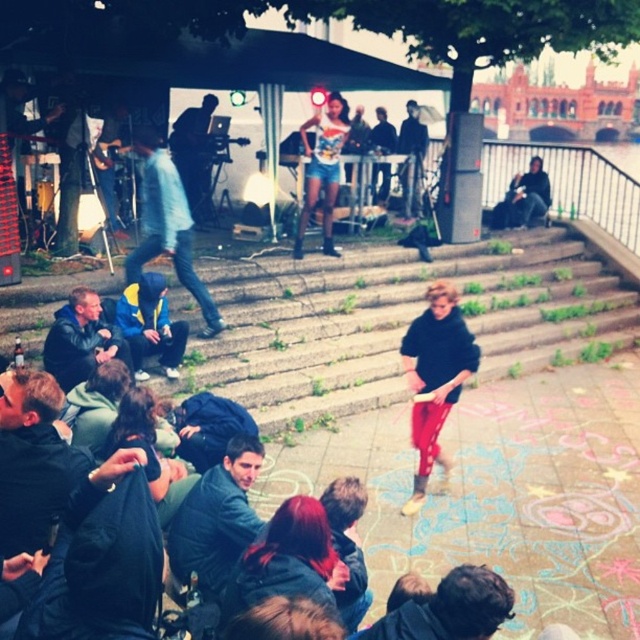
Which is behind, point (241, 460) or point (186, 208)?

Point (186, 208)

You are a GUI agent. You are given a task and a screenshot of the screen. Output one action in this format:
    pyautogui.click(x=<x>, y=<y>)
    Task: Click on the dark blue jacket at lower left
    
    Given the screenshot: What is the action you would take?
    pyautogui.click(x=216, y=518)

Can you confirm if dark blue jacket at lower left is thinner than leather jacket at lower left?

Yes, dark blue jacket at lower left is thinner than leather jacket at lower left.

Which of these two, dark blue jacket at lower left or leather jacket at lower left, stands taller?

dark blue jacket at lower left is taller.

Describe the element at coordinates (216, 518) in the screenshot. I see `dark blue jacket at lower left` at that location.

The image size is (640, 640). Identify the location of dark blue jacket at lower left. (216, 518).

What do you see at coordinates (166, 225) in the screenshot? The height and width of the screenshot is (640, 640). I see `denim jeans at center` at bounding box center [166, 225].

Can you confirm if denim jeans at center is smaller than leather jacket at lower left?

Incorrect, denim jeans at center is not smaller in size than leather jacket at lower left.

Who is more forward, [147,220] or [116,333]?

Point [116,333] is in front.

The width and height of the screenshot is (640, 640). What are the coordinates of `denim jeans at center` in the screenshot? It's located at (166, 225).